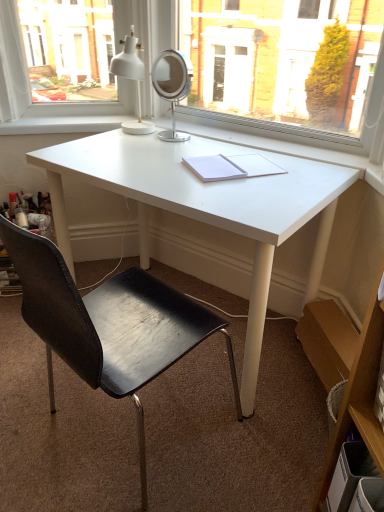
Where is `white paper notebook at center`? The width and height of the screenshot is (384, 512). white paper notebook at center is located at coordinates (231, 167).

What is the approximate width of wooden shelf at right?

wooden shelf at right is 25.68 centimeters wide.

What do you see at coordinates (132, 79) in the screenshot? I see `white matte table lamp at upper center` at bounding box center [132, 79].

Locate an element on the screen. This screenshot has height=512, width=384. white matte desk at center is located at coordinates (206, 206).

From the picture: Can you confirm if white matte table lamp at upper center is taller than wooden shelf at right?

No.

From the image's perspective, who appears lower, white matte table lamp at upper center or wooden shelf at right?

wooden shelf at right is shown below in the image.

What's the angular difference between white matte table lamp at upper center and wooden shelf at right's facing directions?

white matte table lamp at upper center and wooden shelf at right are facing 53.8 degrees away from each other.

How distant is white matte table lamp at upper center from wooden shelf at right?

white matte table lamp at upper center is 4.32 feet away from wooden shelf at right.

Can you tell me how much white matte desk at center and wooden shelf at right differ in facing direction?

The angular difference between white matte desk at center and wooden shelf at right is 49 degrees.

Who is shorter, white matte desk at center or wooden shelf at right?

white matte desk at center.

Considering the relative sizes of white matte desk at center and wooden shelf at right in the image provided, is white matte desk at center thinner than wooden shelf at right?

In fact, white matte desk at center might be wider than wooden shelf at right.

Is white matte desk at center oriented towards wooden shelf at right?

No.

From a real-world perspective, is white paper notebook at center located beneath black leather chair at center?

Incorrect, from a real-world perspective, white paper notebook at center is higher than black leather chair at center.

Which is more to the left, white paper notebook at center or black leather chair at center?

Positioned to the left is black leather chair at center.

Are white paper notebook at center and black leather chair at center located far from each other?

No, there isn't a large distance between white paper notebook at center and black leather chair at center.

Does point (217, 163) lie in front of point (22, 303)?

No.

Is white matte desk at center situated inside white matte table lamp at upper center or outside?

The correct answer is: outside.

Are white matte desk at center and white matte table lamp at upper center far apart?

No, white matte desk at center is not far away from white matte table lamp at upper center.

Measure the distance from white matte desk at center to white matte table lamp at upper center.

18.78 inches.

Is white matte desk at center further to camera compared to white matte table lamp at upper center?

No, the depth of white matte desk at center is less than that of white matte table lamp at upper center.

Is point (43, 302) behind point (126, 72)?

No, it is not.

Based on the photo, is black leather chair at center wider or thinner than white matte table lamp at upper center?

In the image, black leather chair at center appears to be wider than white matte table lamp at upper center.

Is black leather chair at center bigger than white matte table lamp at upper center?

Correct, black leather chair at center is larger in size than white matte table lamp at upper center.

Is black leather chair at center not close to white matte table lamp at upper center?

Actually, black leather chair at center and white matte table lamp at upper center are a little close together.

Consider the image. Considering the positions of objects black leather chair at center and white paper notebook at center in the image provided, who is in front, black leather chair at center or white paper notebook at center?

black leather chair at center is in front.

Is the surface of black leather chair at center in direct contact with white paper notebook at center?

No, black leather chair at center is not next to white paper notebook at center.

From a real-world perspective, is black leather chair at center positioned under white paper notebook at center based on gravity?

Indeed, from a real-world perspective, black leather chair at center is positioned beneath white paper notebook at center.

Can you confirm if black leather chair at center is thinner than white paper notebook at center?

In fact, black leather chair at center might be wider than white paper notebook at center.

Between white paper notebook at center and white matte table lamp at upper center, which one has less height?

white paper notebook at center.

Is white paper notebook at center to the left of white matte table lamp at upper center from the viewer's perspective?

Incorrect, white paper notebook at center is not on the left side of white matte table lamp at upper center.

Considering the relative sizes of white paper notebook at center and white matte table lamp at upper center in the image provided, is white paper notebook at center thinner than white matte table lamp at upper center?

In fact, white paper notebook at center might be wider than white matte table lamp at upper center.

From a real-world perspective, which is physically above, white paper notebook at center or white matte table lamp at upper center?

white matte table lamp at upper center is physically above.

Locate an element on the screen. This screenshot has width=384, height=512. table lamp above the wooden shelf at right (from the image's perspective) is located at coordinates (132, 79).

This screenshot has height=512, width=384. What are the coordinates of `desk that is behind the wooden shelf at right` in the screenshot? It's located at (206, 206).

Looking at the image, which one is located closer to white matte table lamp at upper center, wooden shelf at right or white paper notebook at center?

The object closer to white matte table lamp at upper center is white paper notebook at center.

Looking at the image, which one is located closer to white paper notebook at center, wooden shelf at right or white matte desk at center?

white matte desk at center is positioned closer to the anchor white paper notebook at center.

Based on their spatial positions, is black leather chair at center or white matte table lamp at upper center closer to white matte desk at center?

black leather chair at center.

Based on their spatial positions, is black leather chair at center or white matte desk at center further from white matte table lamp at upper center?

black leather chair at center lies further to white matte table lamp at upper center than the other object.

When comparing their distances from white matte table lamp at upper center, does white paper notebook at center or wooden shelf at right seem further?

wooden shelf at right lies further to white matte table lamp at upper center than the other object.

When comparing their distances from black leather chair at center, does wooden shelf at right or white paper notebook at center seem further?

wooden shelf at right is further to black leather chair at center.

Looking at the image, which one is located closer to wooden shelf at right, black leather chair at center or white matte desk at center?

black leather chair at center lies closer to wooden shelf at right than the other object.

Looking at the image, which one is located further to white matte table lamp at upper center, white matte desk at center or wooden shelf at right?

wooden shelf at right is positioned further to the anchor white matte table lamp at upper center.

Find the location of a particular element. notebook that lies between white matte table lamp at upper center and black leather chair at center from top to bottom is located at coordinates (231, 167).

Where is `desk located between black leather chair at center and white paper notebook at center in the depth direction`? desk located between black leather chair at center and white paper notebook at center in the depth direction is located at coordinates (206, 206).

Where is `notebook located between wooden shelf at right and white matte table lamp at upper center in the depth direction`? notebook located between wooden shelf at right and white matte table lamp at upper center in the depth direction is located at coordinates (231, 167).

You are a GUI agent. You are given a task and a screenshot of the screen. Output one action in this format:
    pyautogui.click(x=<x>, y=<y>)
    Task: Click on the desk between black leather chair at center and wooden shelf at right
    Image resolution: width=384 pixels, height=512 pixels.
    Given the screenshot: What is the action you would take?
    pyautogui.click(x=206, y=206)